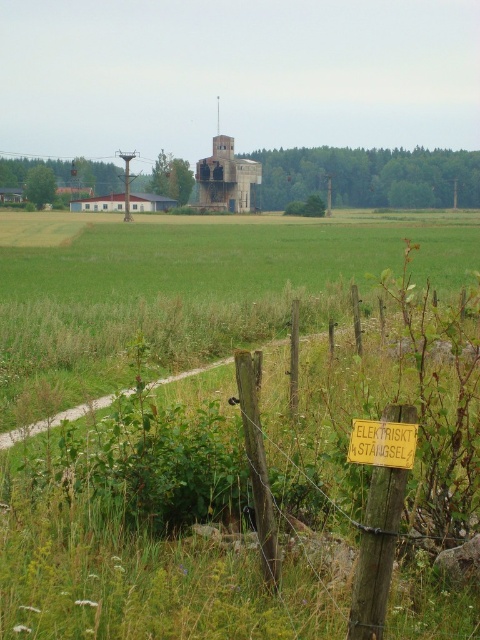
The image size is (480, 640). What do you see at coordinates (226, 177) in the screenshot?
I see `rustic concrete silo at center` at bounding box center [226, 177].

Is rustic concrete silo at center positioned before yellow wood sign at lower center?

No, it is not.

Between point (233, 195) and point (348, 461), which one is positioned in front?

Point (348, 461)

Find the location of `rustic concrete silo at center`. rustic concrete silo at center is located at coordinates (226, 177).

Which is below, wooden post at lower right or rustic concrete silo at center?

wooden post at lower right

Measure the distance between point (478, 296) and camera.

Point (478, 296) and camera are 6.61 meters apart from each other.

At what (x,y) coordinates should I click in order to perform the action: click on wooden post at lower right. Please return your answer as a coordinate pair (x, y). Image resolution: width=480 pixels, height=640 pixels. Looking at the image, I should click on (420, 468).

Who is more distant from viewer, (410, 336) or (368, 445)?

Positioned behind is point (410, 336).

You are a GUI agent. You are given a task and a screenshot of the screen. Output one action in this format:
    pyautogui.click(x=<x>, y=<y>)
    Task: Click on the wooden post at lower right
    
    Given the screenshot: What is the action you would take?
    pyautogui.click(x=420, y=468)

Identify the location of wooden post at lower right. The width and height of the screenshot is (480, 640). (420, 468).